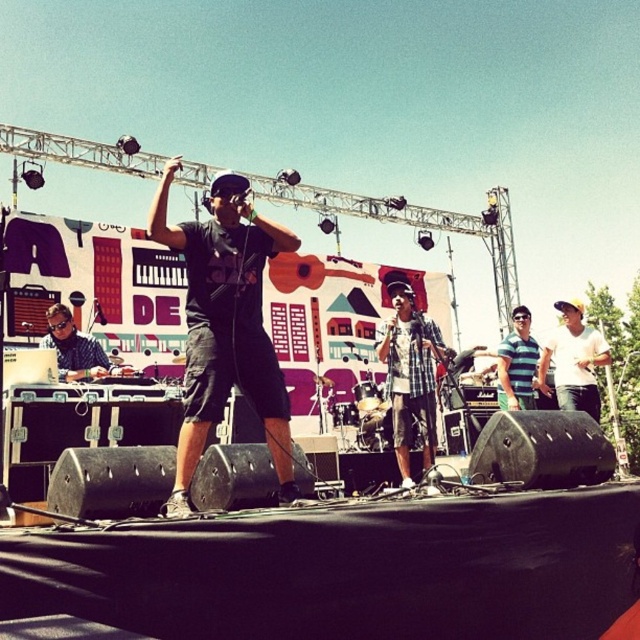
Which is below, white cotton shirt at center or blue striped shirt at center?

blue striped shirt at center

Does white cotton shirt at center have a greater width compared to blue striped shirt at center?

Yes.

Is point (579, 392) closer to viewer compared to point (518, 333)?

Yes, it is in front of point (518, 333).

This screenshot has width=640, height=640. In order to click on white cotton shirt at center in this screenshot , I will do `click(573, 360)`.

Is black matte shirt at center further to camera compared to blue striped shirt at center?

No, black matte shirt at center is closer to the viewer.

Between black matte shirt at center and blue striped shirt at center, which one has more height?

black matte shirt at center is taller.

This screenshot has height=640, width=640. What do you see at coordinates (225, 324) in the screenshot?
I see `black matte shirt at center` at bounding box center [225, 324].

The width and height of the screenshot is (640, 640). I want to click on black matte shirt at center, so click(x=225, y=324).

Who is more forward, (404, 285) or (58, 326)?

Positioned in front is point (58, 326).

Does checkered fabric shirt at center lie behind matte black headphones at center?

No, checkered fabric shirt at center is in front of matte black headphones at center.

Is point (388, 285) closer to viewer compared to point (100, 364)?

No, it is not.

Locate an element on the screen. checkered fabric shirt at center is located at coordinates (410, 376).